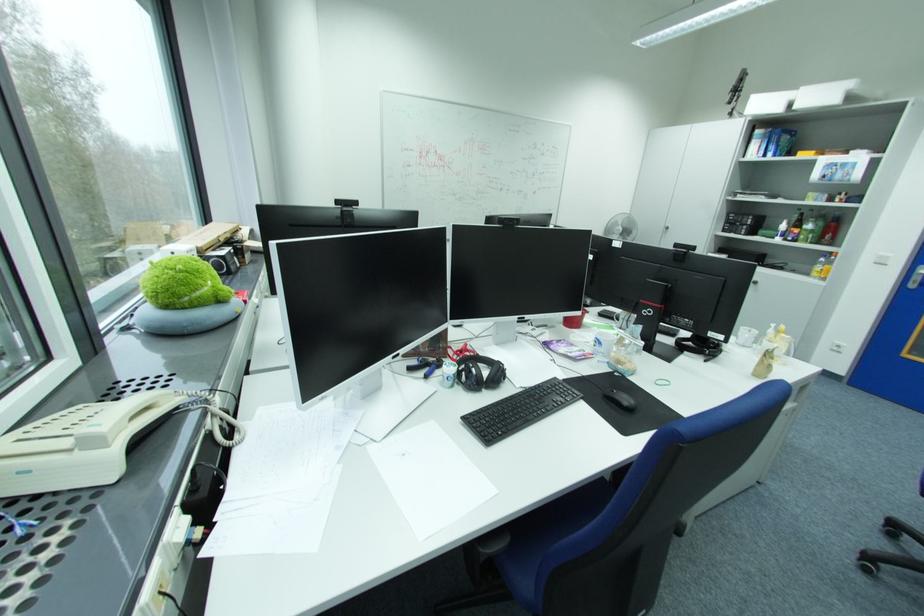
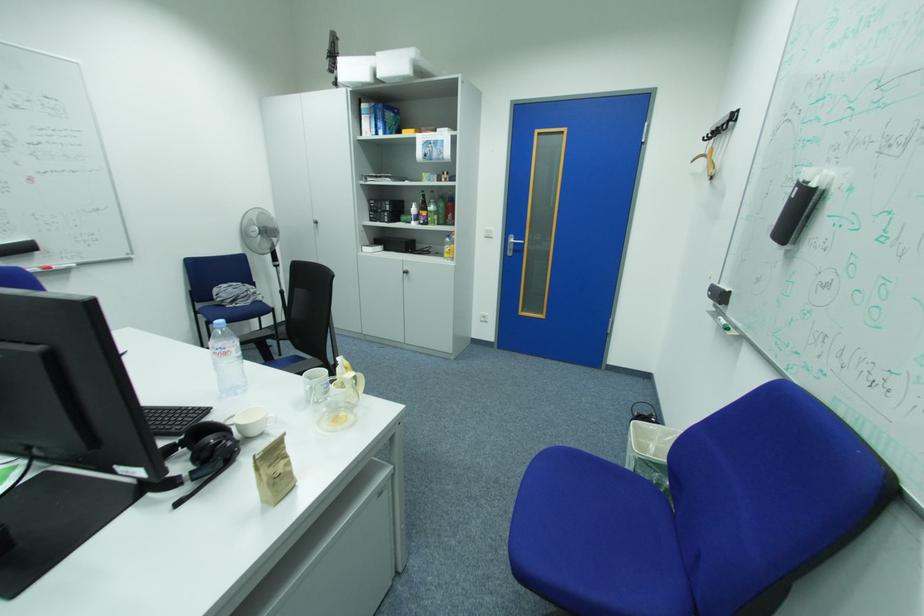
The point at [793,336] is marked in the first image. Where is the corresponding point in the second image?

(359, 374)